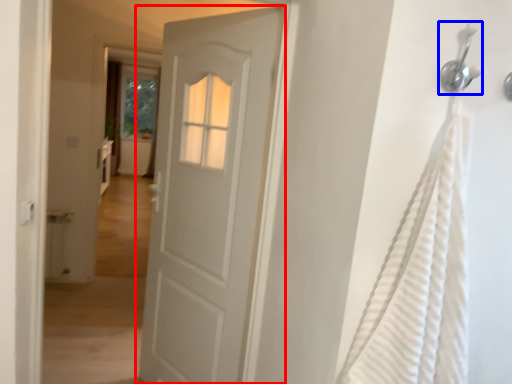
Question: Which object is closer to the camera taking this photo, door (highlighted by a red box) or shower (highlighted by a blue box)?

Choices:
 (A) door
 (B) shower

Answer: (B)